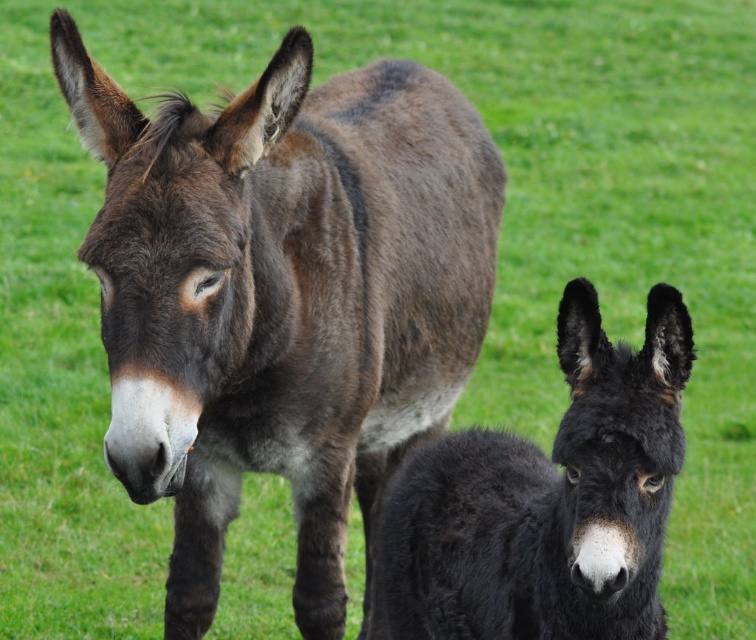
Question: Is dark brown fur mule at center behind black fuzzy donkey at lower right?

Choices:
 (A) no
 (B) yes

Answer: (B)

Question: From the image, what is the correct spatial relationship of dark brown fur mule at center in relation to black fuzzy donkey at lower right?

Choices:
 (A) above
 (B) below

Answer: (A)

Question: Is dark brown fur mule at center to the right of black fuzzy donkey at lower right from the viewer's perspective?

Choices:
 (A) no
 (B) yes

Answer: (A)

Question: Which point appears closest to the camera in this image?

Choices:
 (A) (299, 168)
 (B) (600, 595)

Answer: (B)

Question: Among these points, which one is nearest to the camera?

Choices:
 (A) (488, 198)
 (B) (575, 484)

Answer: (B)